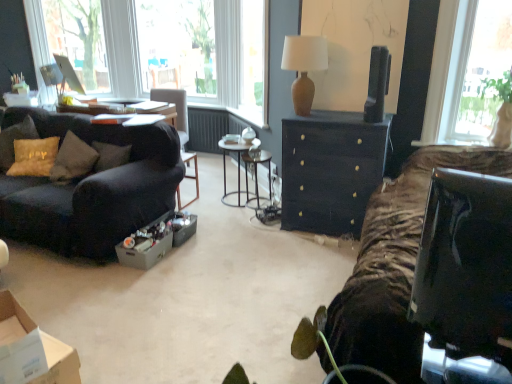
I want to click on free space to the left of metallic silver side table at center, so click(x=207, y=200).